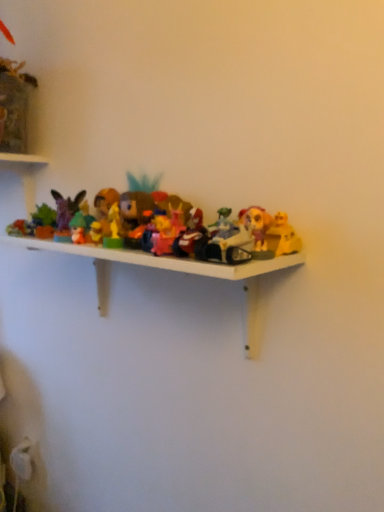
Question: Is shiny silver motorcycle at center, the second toy in the right-to-left sequence, positioned behind matte plastic toy at center, the third toy positioned from the right?

Choices:
 (A) yes
 (B) no

Answer: (B)

Question: Is shiny silver motorcycle at center, which is counted as the 6th toy, starting from the left, taller than matte plastic toy at center, acting as the fifth toy starting from the left?

Choices:
 (A) yes
 (B) no

Answer: (A)

Question: From the image's perspective, is shiny silver motorcycle at center, the second toy in the right-to-left sequence, beneath matte plastic toy at center, acting as the fifth toy starting from the left?

Choices:
 (A) no
 (B) yes

Answer: (B)

Question: Is shiny silver motorcycle at center, the second toy in the right-to-left sequence, shorter than matte plastic toy at center, the third toy positioned from the right?

Choices:
 (A) no
 (B) yes

Answer: (A)

Question: Is shiny silver motorcycle at center, which is counted as the 6th toy, starting from the left, not close to matte plastic toy at center, the third toy positioned from the right?

Choices:
 (A) no
 (B) yes

Answer: (A)

Question: From a real-world perspective, does shiny silver motorcycle at center, which is counted as the 6th toy, starting from the left, sit lower than matte plastic toy at center, the third toy positioned from the right?

Choices:
 (A) no
 (B) yes

Answer: (A)

Question: Does pink plastic toy at center, which appears as the fourth toy when viewed from the right, have a lesser width compared to matte purple figurine at left, which ranks as the seventh toy in right-to-left order?

Choices:
 (A) no
 (B) yes

Answer: (A)

Question: Can you confirm if pink plastic toy at center, the fourth toy from the left, is positioned to the right of matte purple figurine at left, which ranks as the seventh toy in right-to-left order?

Choices:
 (A) yes
 (B) no

Answer: (A)

Question: Does pink plastic toy at center, the fourth toy from the left, have a greater height compared to matte purple figurine at left, which ranks as the seventh toy in right-to-left order?

Choices:
 (A) no
 (B) yes

Answer: (A)

Question: Considering the relative sizes of pink plastic toy at center, which appears as the fourth toy when viewed from the right, and matte purple figurine at left, the 1th toy positioned from the left, in the image provided, is pink plastic toy at center, which appears as the fourth toy when viewed from the right, shorter than matte purple figurine at left, the 1th toy positioned from the left,?

Choices:
 (A) yes
 (B) no

Answer: (A)

Question: Is pink plastic toy at center, the fourth toy from the left, positioned in front of matte purple figurine at left, which ranks as the seventh toy in right-to-left order?

Choices:
 (A) no
 (B) yes

Answer: (B)

Question: Is the surface of pink plastic toy at center, the fourth toy from the left, in direct contact with matte purple figurine at left, which ranks as the seventh toy in right-to-left order?

Choices:
 (A) yes
 (B) no

Answer: (B)

Question: Is green matte figurine at center, which ranks as the second toy in left-to-right order, not inside shiny silver motorcycle at center, which is counted as the 6th toy, starting from the left?

Choices:
 (A) yes
 (B) no

Answer: (A)